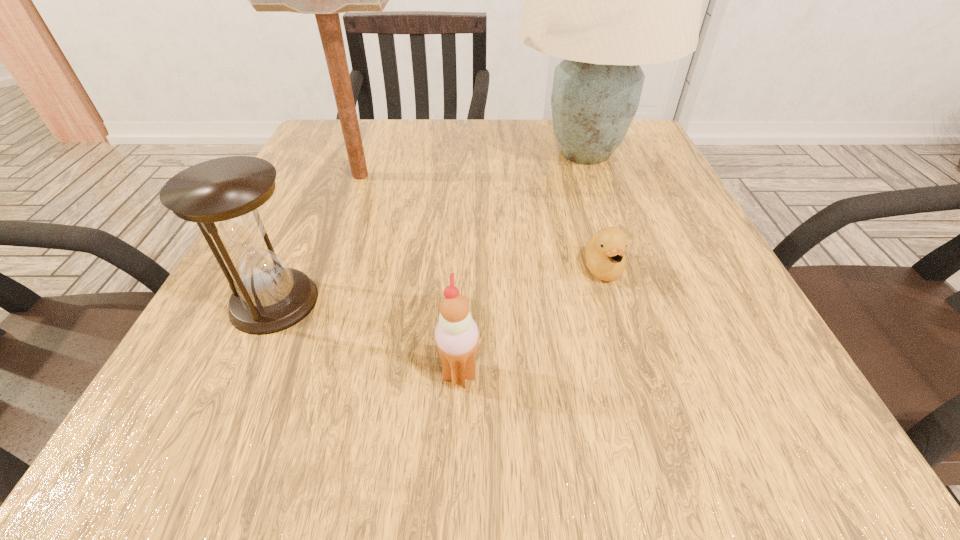
Image resolution: width=960 pixels, height=540 pixels. Find the location of `vacant space located 0.090m on the face of the shortest object`. vacant space located 0.090m on the face of the shortest object is located at coordinates (623, 337).

The width and height of the screenshot is (960, 540). I want to click on lampshade located at the far edge, so click(x=606, y=0).

The height and width of the screenshot is (540, 960). I want to click on mallet that is at the far edge, so click(326, 0).

Locate an element on the screen. mallet located in the left edge section of the desktop is located at coordinates (326, 0).

I want to click on hourglass at the left edge, so click(226, 197).

The height and width of the screenshot is (540, 960). Find the location of `lampshade that is at the right edge`. lampshade that is at the right edge is located at coordinates (606, 0).

You are a GUI agent. You are given a task and a screenshot of the screen. Output one action in this format:
    pyautogui.click(x=<x>, y=<y>)
    Task: Click on the duckling that is positioned at the right edge
    
    Given the screenshot: What is the action you would take?
    pyautogui.click(x=605, y=258)

The height and width of the screenshot is (540, 960). What are the coordinates of `object positioned at the far left corner` in the screenshot? It's located at [x=326, y=0].

I want to click on object that is at the far right corner, so click(606, 0).

What are the coordinates of `vacant region at the far edge of the desktop` in the screenshot? It's located at (545, 140).